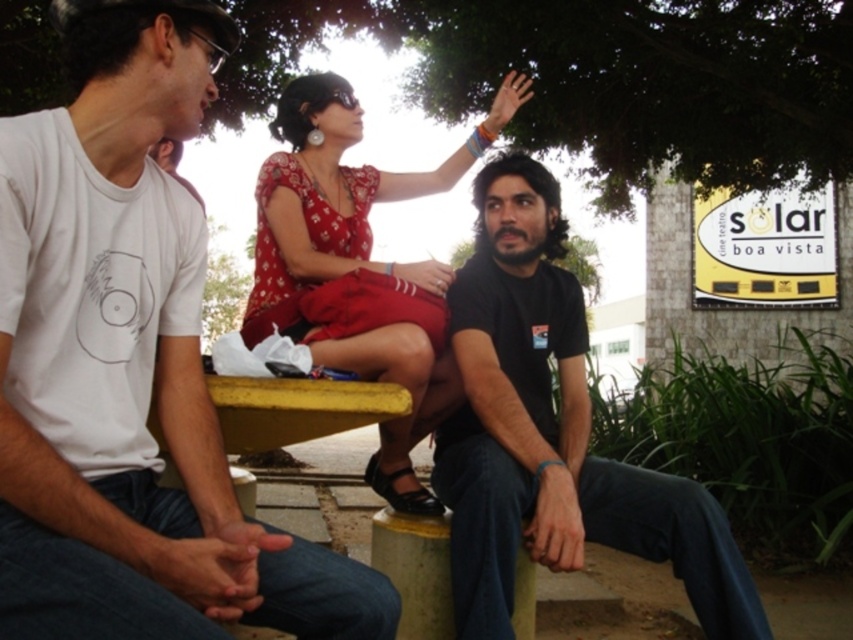
You are standing in front of the scene and want to greet both the black matte shirt at center and the matte red dress at center. Which one should you approach first to greet?

You should approach the black matte shirt at center first because it is closer to you than the matte red dress at center.

You are a photographer trying to capture a group photo of the black matte shirt at center and the matte red dress at center. Which one should you focus on first if you want to ensure both are in focus?

The black matte shirt at center has a lesser height compared to the matte red dress at center, so you should focus on the matte red dress at center first since it is taller and might require more precise focus to capture details.